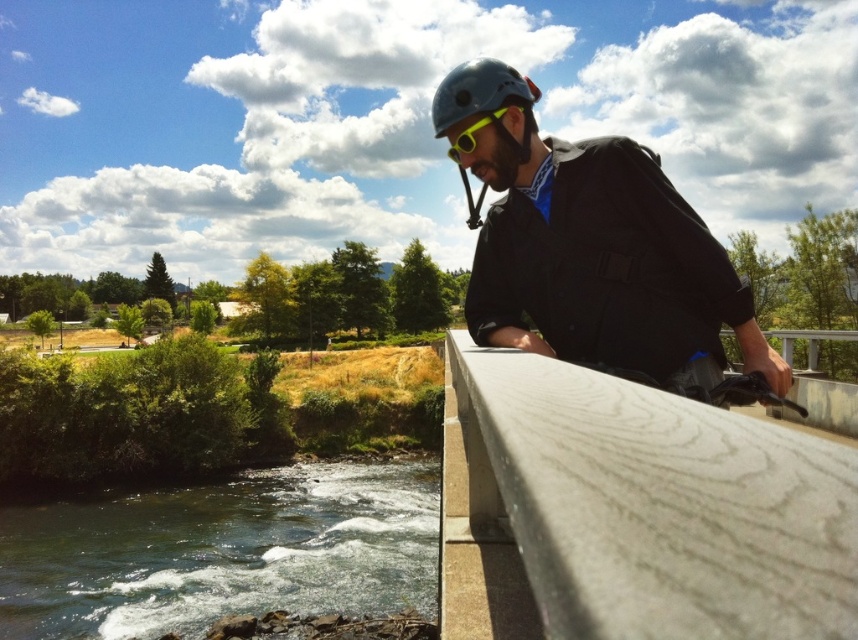
Which is above, smooth concrete ledge at upper right or yellow matte/glossy goggles at center?

yellow matte/glossy goggles at center is higher up.

Is point (683, 570) behind point (461, 132)?

No.

Find the location of a particular element. Image resolution: width=858 pixels, height=640 pixels. smooth concrete ledge at upper right is located at coordinates (632, 512).

Between point (485, 342) and point (461, 134), which one is positioned in front?

Point (461, 134) is in front.

Between matte black helmet at upper right and yellow matte/glossy goggles at center, which one is positioned higher?

yellow matte/glossy goggles at center

Is point (674, 360) farther from camera compared to point (475, 141)?

No, (674, 360) is closer to viewer.

This screenshot has width=858, height=640. Find the location of `matte black helmet at upper right`. matte black helmet at upper right is located at coordinates (591, 246).

How much distance is there between greenish-gray water at lower left and matte black helmet at upper right?

greenish-gray water at lower left is 80.90 feet from matte black helmet at upper right.

Is point (245, 547) closer to camera compared to point (631, 212)?

No, (245, 547) is further to viewer.

The image size is (858, 640). In order to click on greenish-gray water at lower left in this screenshot , I will do `click(222, 552)`.